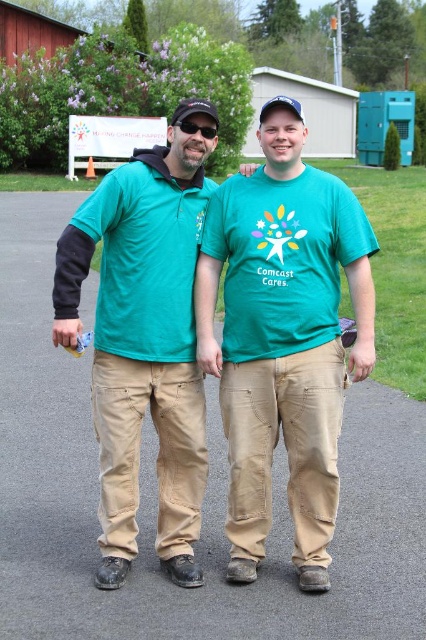
Question: Can you confirm if matte khaki pants at center is bigger than black plastic sunglasses at center?

Choices:
 (A) yes
 (B) no

Answer: (A)

Question: Is matte green shirt at center to the right of black plastic sunglasses at center from the viewer's perspective?

Choices:
 (A) yes
 (B) no

Answer: (B)

Question: Does matte khaki pants at center have a larger size compared to black plastic sunglasses at center?

Choices:
 (A) no
 (B) yes

Answer: (B)

Question: Estimate the real-world distances between objects in this image. Which object is farther from the matte green shirt at center?

Choices:
 (A) matte khaki pants at center
 (B) black plastic sunglasses at center

Answer: (B)

Question: Which of these objects is positioned closest to the matte khaki pants at center?

Choices:
 (A) black plastic sunglasses at center
 (B) matte green shirt at center

Answer: (B)

Question: Which point is farther to the camera?

Choices:
 (A) (215, 129)
 (B) (233, 339)
 (C) (184, 561)

Answer: (B)